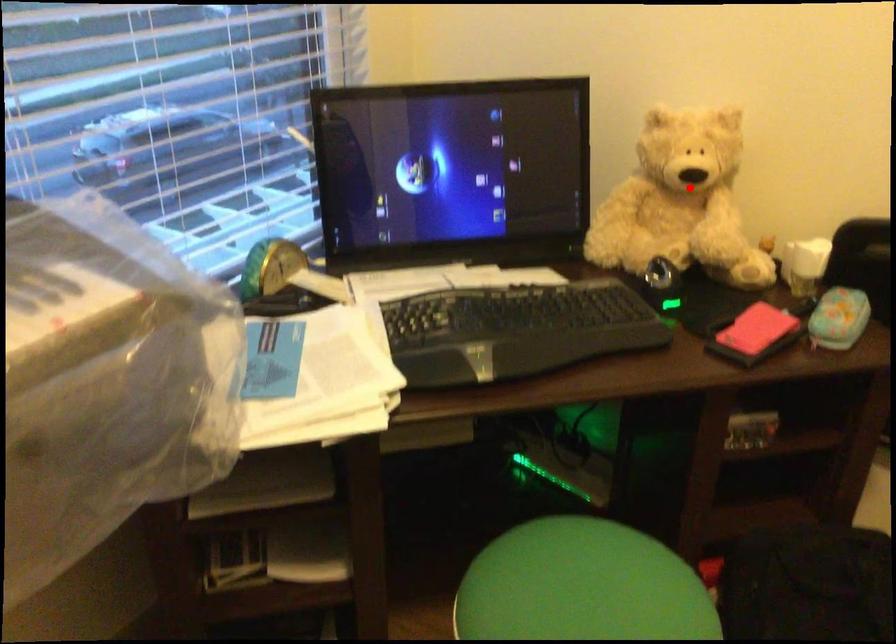
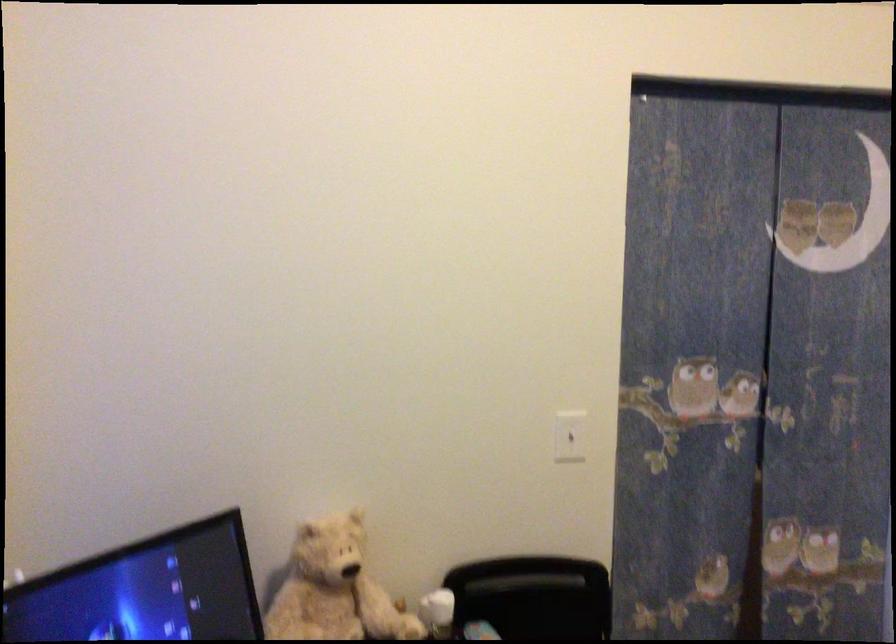
Question: I am providing you with two images of the same scene from different viewpoints. A red point is shown in image1. For the corresponding object point in image2, is it positioned nearer or farther from the camera?

Choices:
 (A) Nearer
 (B) Farther

Answer: (B)